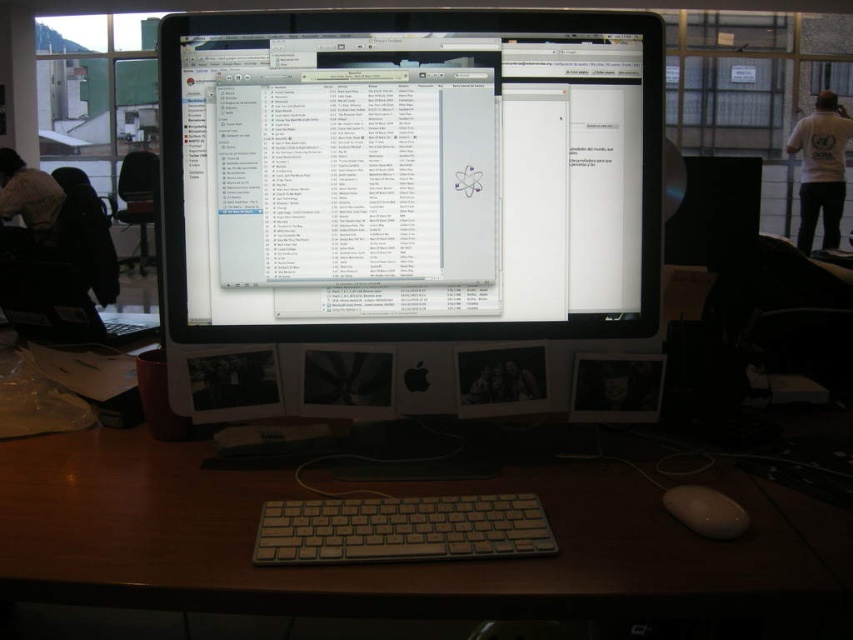
Consider the image. You are setting up a new monitor on your desk and want to place it exactly where the wooden desk at center is located. Given that the wooden desk at center is represented by the point coordinates point [404,563], can you determine the exact coordinates of the wooden desk at center?

The wooden desk at center is represented by the point coordinates point [404,563], so the exact coordinates of the wooden desk at center are 0.881 and 0.475.

Based on the photo, you are organizing a desk and need to place a new item between the satin black monitor at center and the white fabric shirt at left. Based on their positions, which object should the new item be closer to?

The new item should be closer to the white fabric shirt at left because the satin black monitor at center is closer to the viewer, meaning the white fabric shirt at left is farther away. Placing the new item closer to the shirt would maintain the spatial relationship between the two objects.

You are organizing your workspace and need to place a new item between the wooden desk at center and the white fabric shirt at left. Which object should you place the new item closer to based on their sizes?

Since the wooden desk at center is smaller than the white fabric shirt at left, the new item should be placed closer to the wooden desk at center to accommodate the size difference.